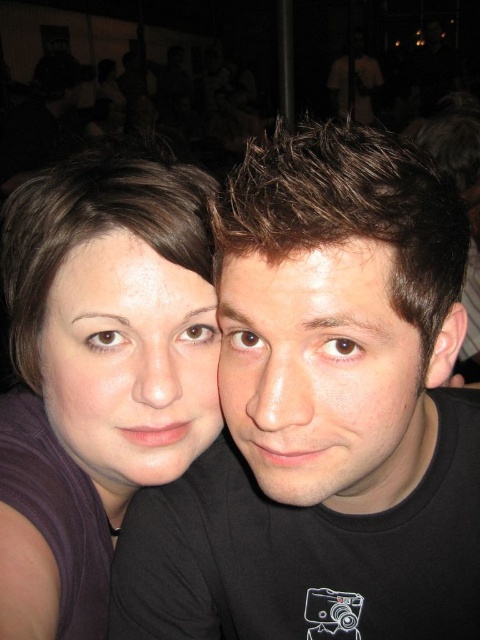
Question: Is smooth skin face at center positioned before matte brown hair at center?

Choices:
 (A) yes
 (B) no

Answer: (A)

Question: Does matte purple shirt at left have a lesser width compared to matte brown hair at center?

Choices:
 (A) no
 (B) yes

Answer: (A)

Question: Among these points, which one is nearest to the camera?

Choices:
 (A) (290, 458)
 (B) (303, 272)

Answer: (B)

Question: Which point appears closest to the camera in this image?

Choices:
 (A) pos(216,364)
 (B) pos(218,288)
 (C) pos(66,339)
 (D) pos(349,330)

Answer: (D)

Question: Estimate the real-world distances between objects in this image. Which object is closer to the matte brown hair at center?

Choices:
 (A) black matte shirt at center
 (B) matte skin face at left

Answer: (B)

Question: Does matte purple shirt at left have a greater width compared to smooth skin face at center?

Choices:
 (A) yes
 (B) no

Answer: (A)